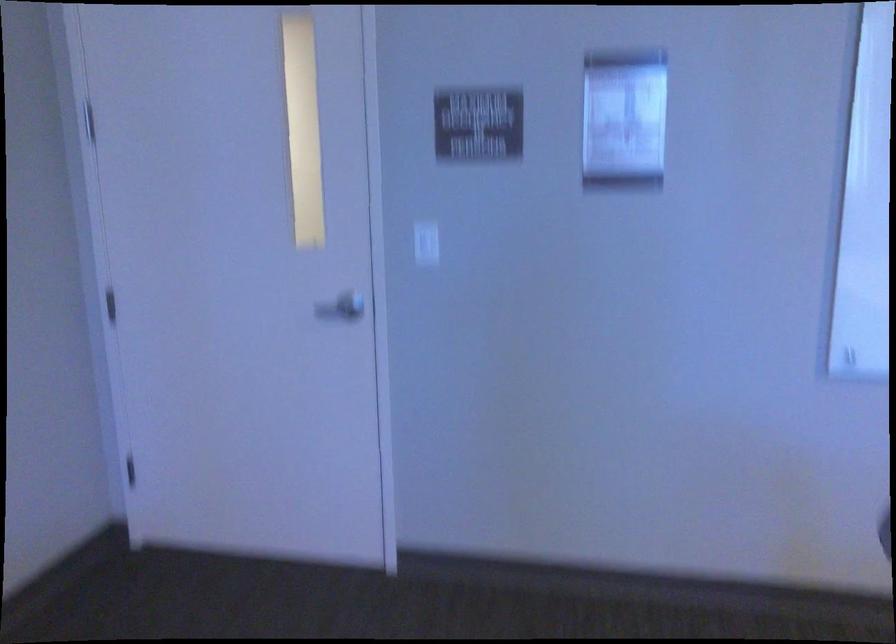
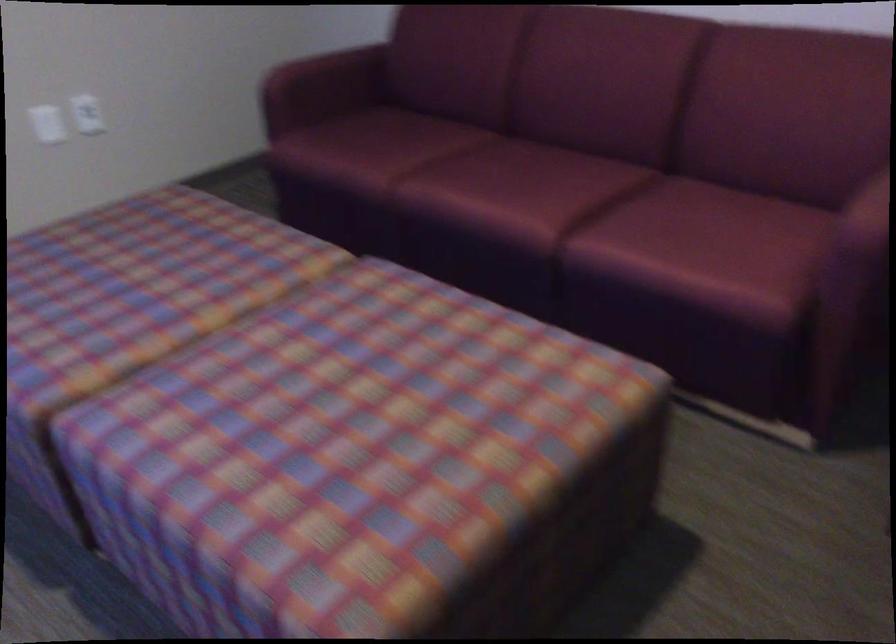
The first image is from the beginning of the video and the second image is from the end. How did the camera likely rotate when shooting the video?

The camera rotated toward left-down.